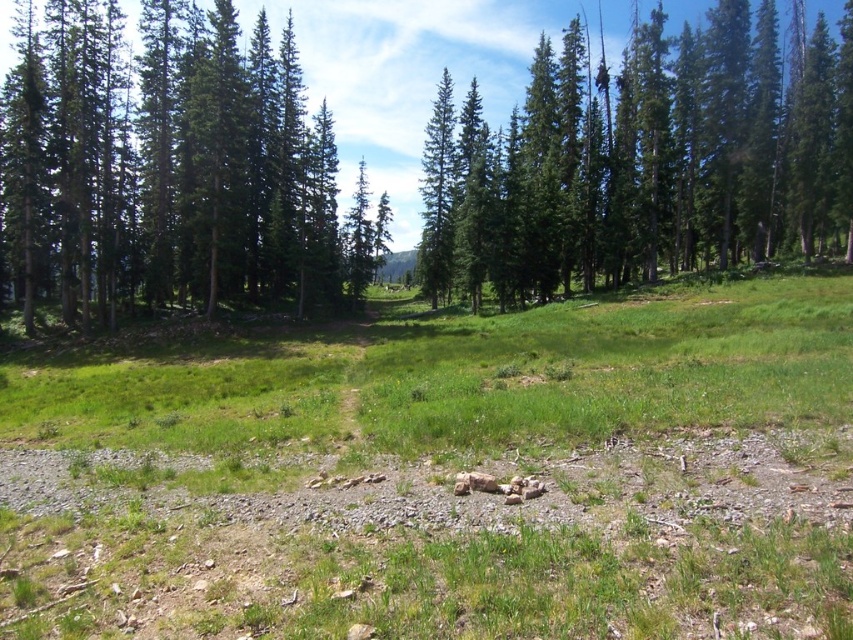
Question: Among these points, which one is farthest from the camera?

Choices:
 (A) (212, 74)
 (B) (811, 227)
 (C) (149, 13)

Answer: (B)

Question: From the image, what is the correct spatial relationship of green matte tree at upper left in relation to green coniferous trees at upper center?

Choices:
 (A) right
 (B) left

Answer: (B)

Question: Can you confirm if green coniferous forest at center is wider than green matte tree at upper left?

Choices:
 (A) yes
 (B) no

Answer: (A)

Question: Is the position of green matte tree at upper left more distant than that of green coniferous trees at upper center?

Choices:
 (A) no
 (B) yes

Answer: (A)

Question: Which of the following is the closest to the observer?

Choices:
 (A) (236, 168)
 (B) (460, 296)
 (C) (485, 252)

Answer: (A)

Question: Which is farther from the green matte tree at upper left?

Choices:
 (A) green coniferous trees at upper center
 (B) green coniferous forest at center

Answer: (B)